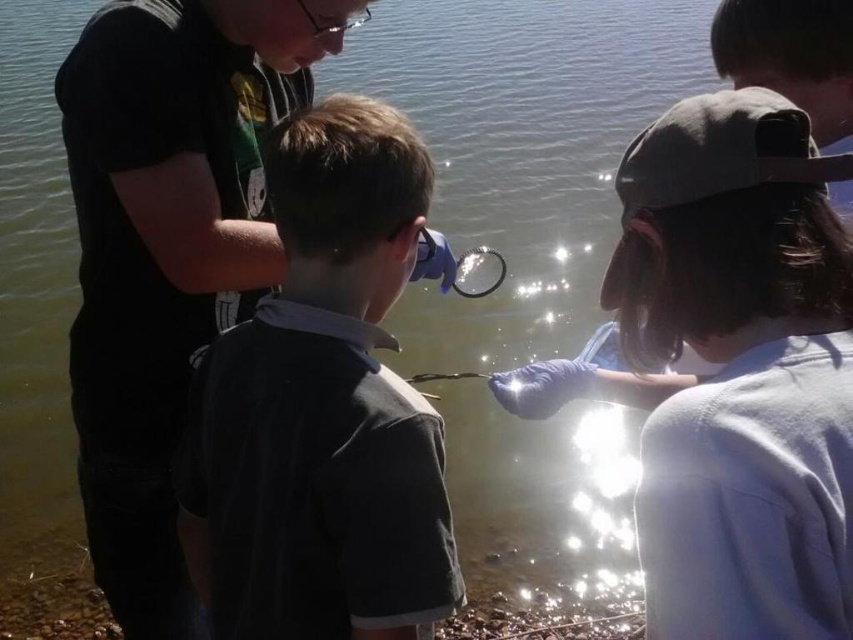
Is black matte shirt at left above transparent plastic magnifying glass at center?

No, black matte shirt at left is not above transparent plastic magnifying glass at center.

Does point (221, 6) come behind point (483, 282)?

No.

What are the coordinates of `black matte shirt at left` in the screenshot? It's located at coord(167,248).

Is light blue fabric at center further to the viewer compared to black matte shirt at left?

No, light blue fabric at center is in front of black matte shirt at left.

Image resolution: width=853 pixels, height=640 pixels. Describe the element at coordinates (740, 369) in the screenshot. I see `light blue fabric at center` at that location.

Where is `light blue fabric at center`? The width and height of the screenshot is (853, 640). light blue fabric at center is located at coordinates (740, 369).

Can you confirm if dark gray cotton shirt at center is positioned to the left of black matte shirt at left?

Incorrect, dark gray cotton shirt at center is not on the left side of black matte shirt at left.

Between dark gray cotton shirt at center and black matte shirt at left, which one appears on the left side from the viewer's perspective?

black matte shirt at left is more to the left.

Image resolution: width=853 pixels, height=640 pixels. Find the location of `dark gray cotton shirt at center`. dark gray cotton shirt at center is located at coordinates (322, 408).

Identify the location of dark gray cotton shirt at center. This screenshot has width=853, height=640. (322, 408).